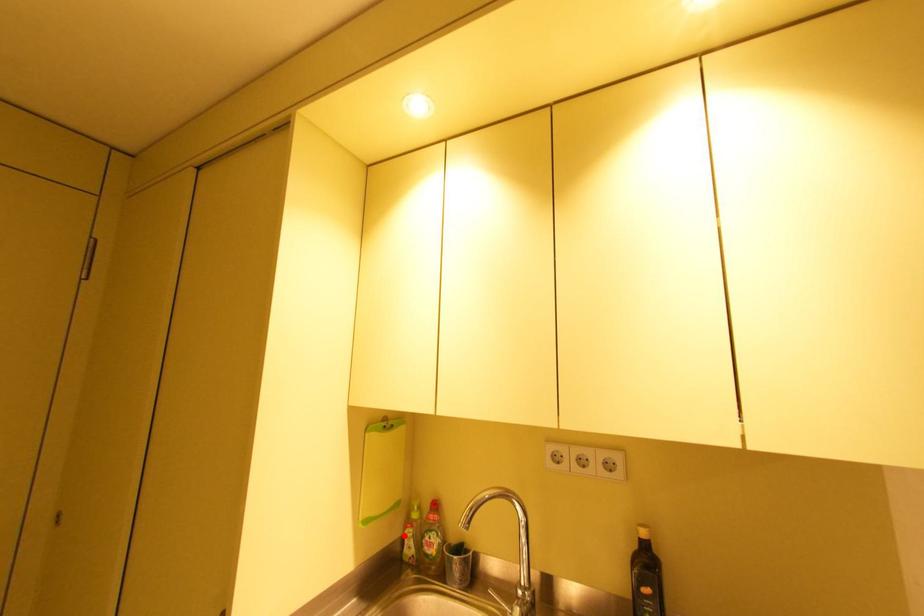
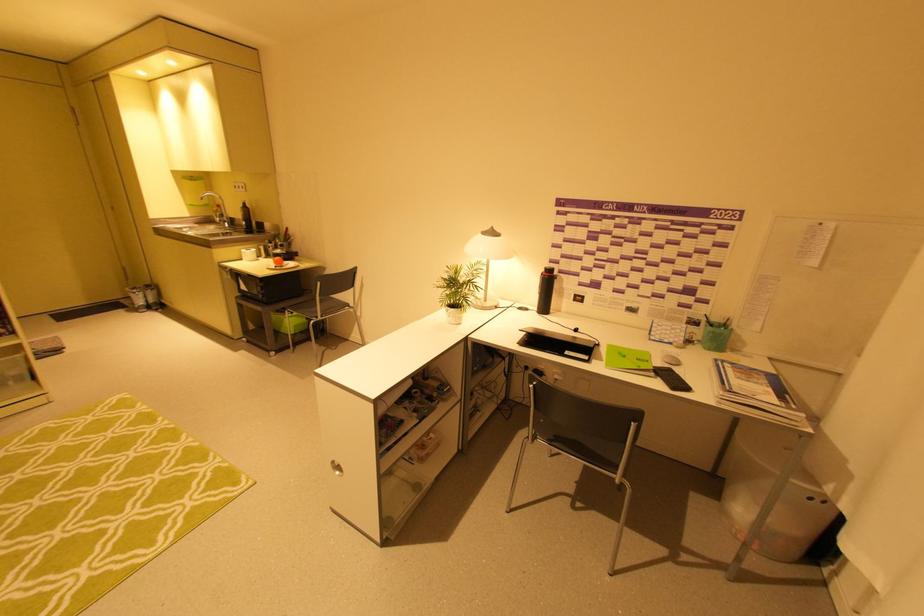
Question: I am providing you with two images of the same scene from different viewpoints. Given a red point in image1, look at the same physical point in image2. Is it:

Choices:
 (A) Closer to the viewpoint
 (B) Farther from the viewpoint

Answer: (A)